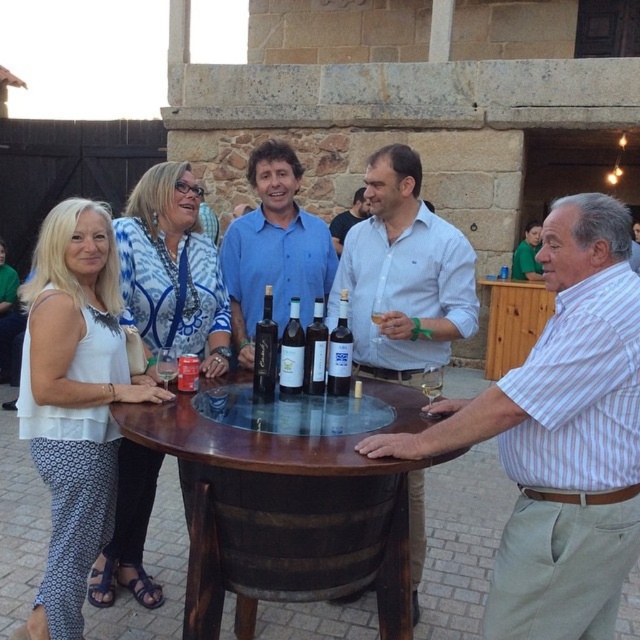
Question: Which object is the closest to the clear glass wine at table center?

Choices:
 (A) white lace dress at left
 (B) wooden barrel at center
 (C) dark glass bottle at center

Answer: (A)

Question: Estimate the real-world distances between objects in this image. Which object is closer to the matte glass bottle at center?

Choices:
 (A) white lace dress at left
 (B) translucent glass bottle at center

Answer: (B)

Question: Observing the image, what is the correct spatial positioning of white lace dress at left in reference to translucent glass bottle at center?

Choices:
 (A) above
 (B) below

Answer: (A)

Question: Can you confirm if black glass bottle at center is smaller than matte glass bottle at center?

Choices:
 (A) yes
 (B) no

Answer: (B)

Question: Which object appears farthest from the camera in this image?

Choices:
 (A) black glass bottle at center
 (B) white striped shirt at center
 (C) matte glass bottles at center

Answer: (A)

Question: Is white striped shirt at center to the right of matte blue shirt at center from the viewer's perspective?

Choices:
 (A) no
 (B) yes

Answer: (B)